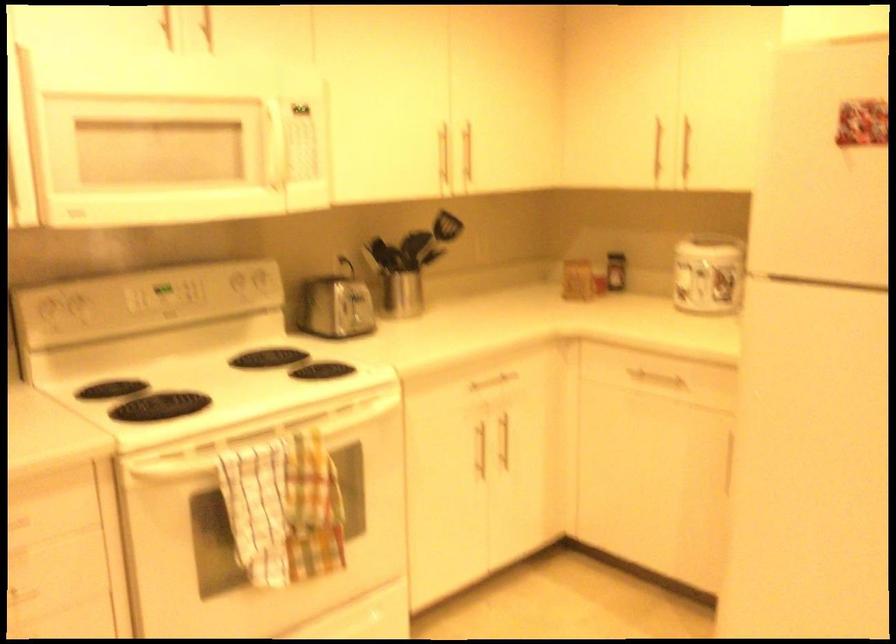
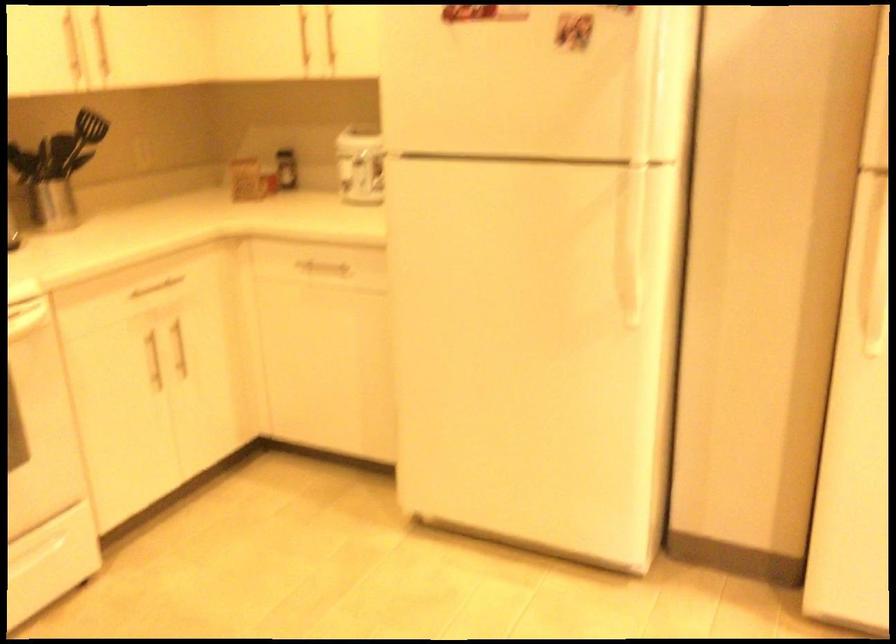
Where in the second image is the point corresponding to (661,379) from the first image?

(323, 268)